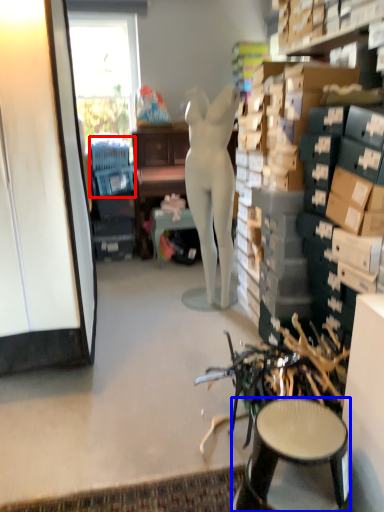
Question: Which object is closer to the camera taking this photo, swivel chair (highlighted by a red box) or stool (highlighted by a blue box)?

Choices:
 (A) swivel chair
 (B) stool

Answer: (B)